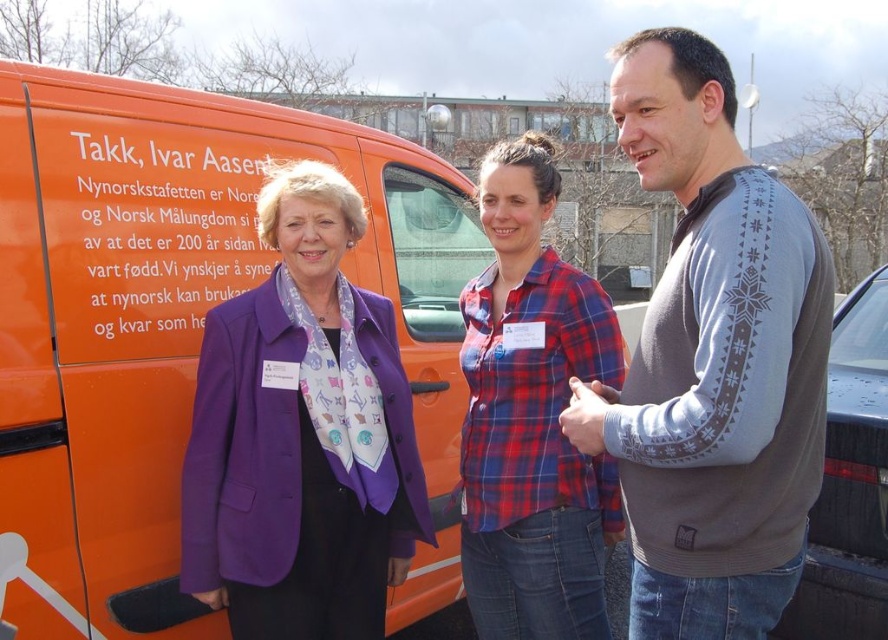
Consider the image. You are a photographer trying to capture a clear shot of the plaid fabric shirt at center. However, the purple satin blazer at center is blocking your view. Can you move the blazer to the side to get a better shot?

The purple satin blazer at center is in front of the plaid fabric shirt at center, so moving it aside would allow you to see the plaid fabric shirt at center clearly.

You are a photographer standing at a certain distance from the purple satin blazer at center. You want to take a photo of the blazer while ensuring the orange van with text on its side is also fully visible in the frame. Based on the given distance between you and the blazer, can you estimate whether the van will be fully visible in your photo?

Result: The distance between the purple satin blazer at center and the camera is 7.06 feet. Since the van is positioned next to the blazer, it should be within the camera frame if the photographer is positioned to include both the blazer and the van in the shot. However, the exact visibility depends on the camera lens and angle used, but based on the given distance alone, the van is likely visible as it is adjacent to the blazer.

You are a fashion designer who wants to place a new accessory on the purple satin blazer at center. Where exactly should you place it?

The purple satin blazer at center is located at point (302,435), so the accessory should be placed at that coordinate.